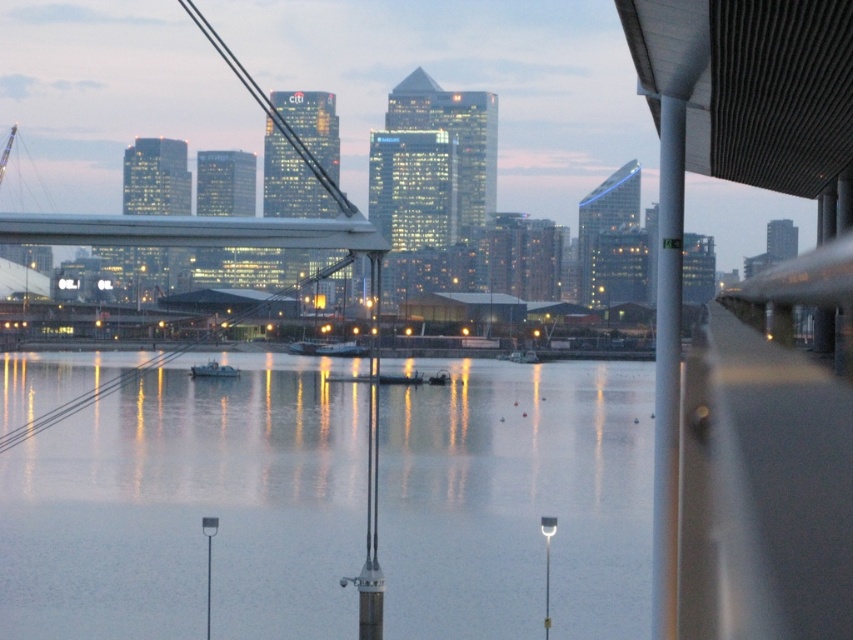
Question: From the image, what is the correct spatial relationship of smooth water at center in relation to metallic gray boat at center?

Choices:
 (A) right
 (B) left

Answer: (A)

Question: Is smooth water at center positioned before metallic gray boat at center?

Choices:
 (A) yes
 (B) no

Answer: (A)

Question: Which of the following is the closest to the observer?

Choices:
 (A) metallic gray boat at center
 (B) smooth water at center

Answer: (B)

Question: Can you confirm if smooth water at center is positioned above metallic gray boat at center?

Choices:
 (A) yes
 (B) no

Answer: (B)